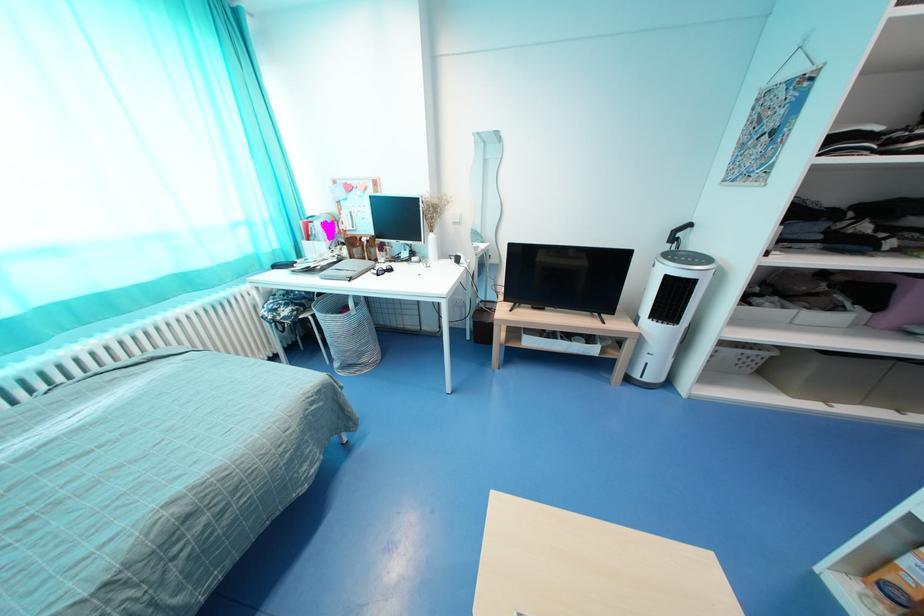
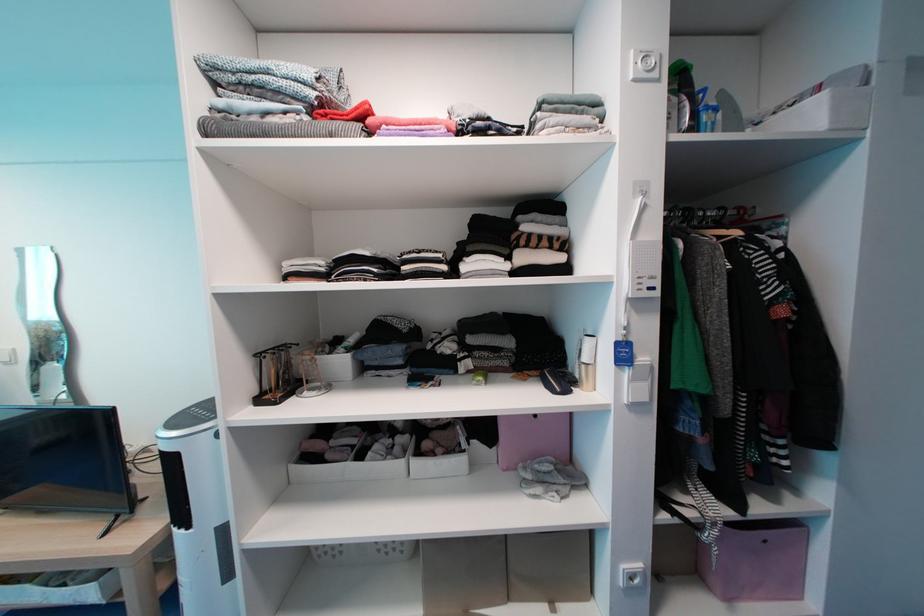
Question: What movement of the cameraman would produce the second image?

Choices:
 (A) Left
 (B) Right
 (C) Forward
 (D) Backward

Answer: (B)